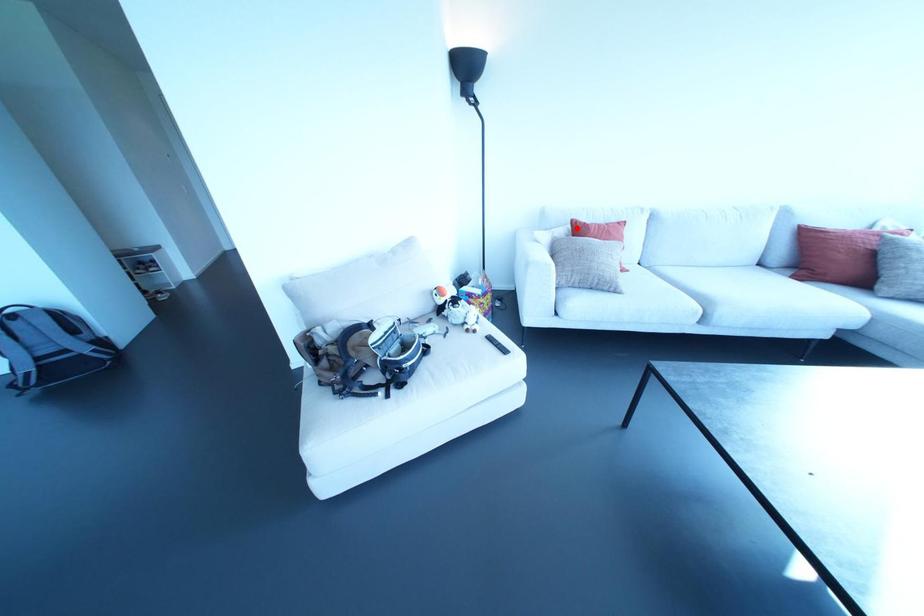
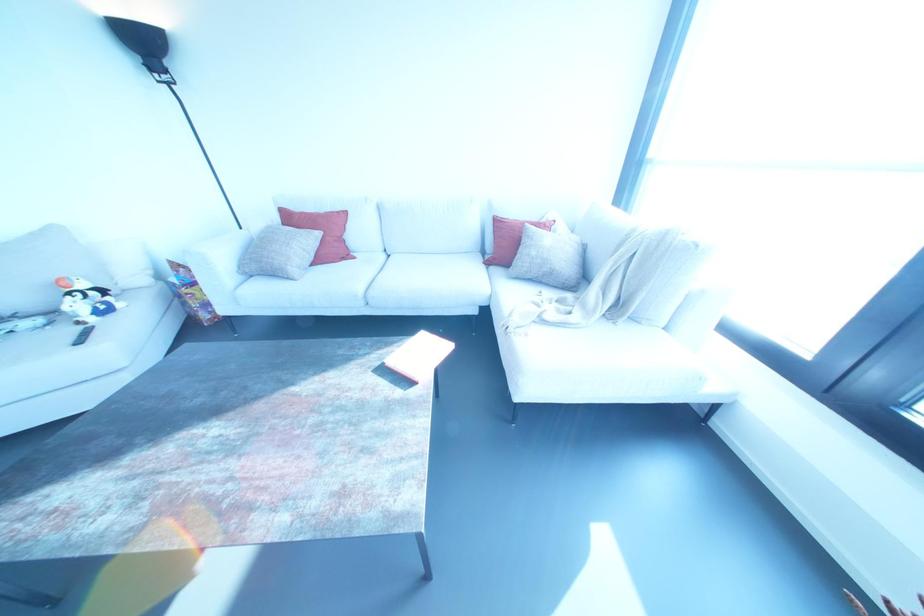
Where in the second image is the point corresponding to the highlighted location from the first image?

(286, 217)